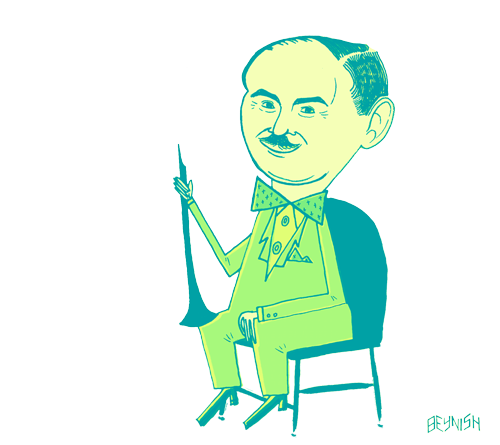
Find the location of `chair leg`. chair leg is located at coordinates (297, 386), (375, 377).